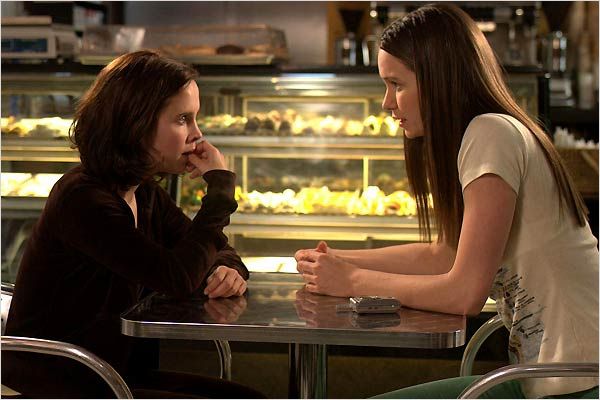
You are a GUI agent. You are given a task and a screenshot of the screen. Output one action in this format:
    pyautogui.click(x=<x>, y=<y>)
    Task: Click on the empty space on table
    This screenshot has height=400, width=600.
    Given the screenshot: What is the action you would take?
    pyautogui.click(x=271, y=302)